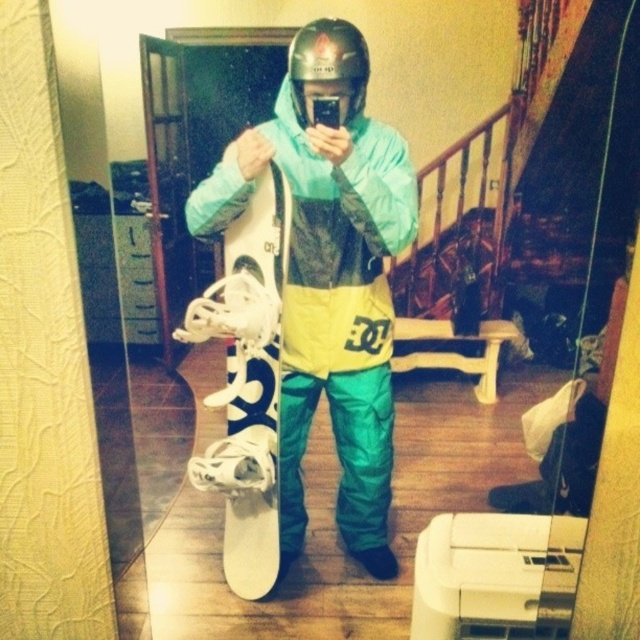
The height and width of the screenshot is (640, 640). What do you see at coordinates (330, 276) in the screenshot? I see `matte white snowboard at center` at bounding box center [330, 276].

Which is in front, point (394, 228) or point (339, 52)?

Point (339, 52) is in front.

Between point (280, 145) and point (333, 29), which one is positioned behind?

Point (280, 145)

Where is `matte white snowboard at center`? This screenshot has height=640, width=640. matte white snowboard at center is located at coordinates (330, 276).

Looking at this image, can you confirm if white matte snowboard at center is thinner than matte black helmet at center?

In fact, white matte snowboard at center might be wider than matte black helmet at center.

Is white matte snowboard at center bigger than matte black helmet at center?

Indeed, white matte snowboard at center has a larger size compared to matte black helmet at center.

Which is behind, point (260, 275) or point (349, 68)?

The point (260, 275) is more distant.

This screenshot has height=640, width=640. I want to click on white matte snowboard at center, so click(262, 234).

Is the position of matte white snowboard at center more distant than that of white matte snowboard at center?

No, matte white snowboard at center is closer to the viewer.

Does matte white snowboard at center have a lesser width compared to white matte snowboard at center?

Incorrect, matte white snowboard at center's width is not less than white matte snowboard at center's.

Measure the distance between point (365, 248) and camera.

Point (365, 248) and camera are 1.70 meters apart from each other.

This screenshot has width=640, height=640. Identify the location of matte white snowboard at center. (330, 276).